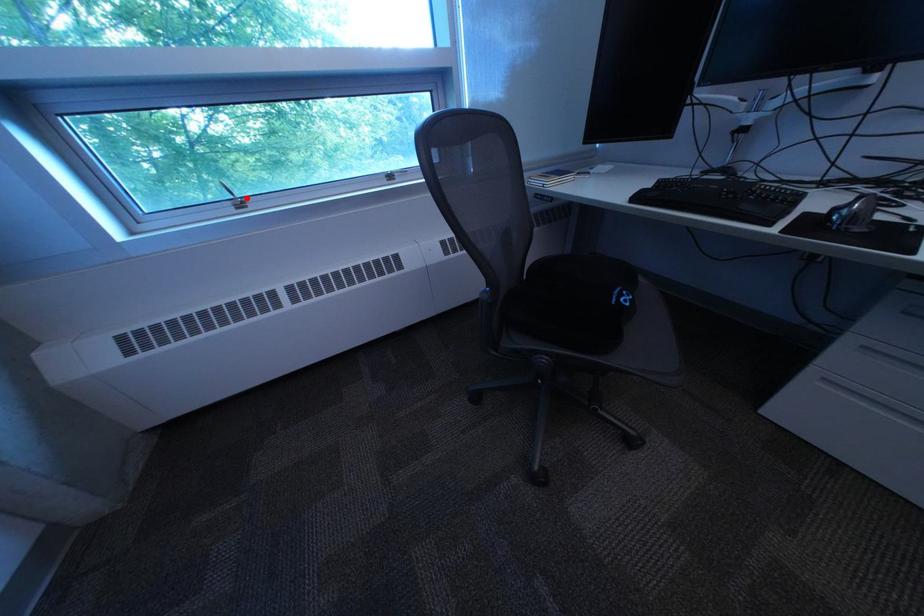
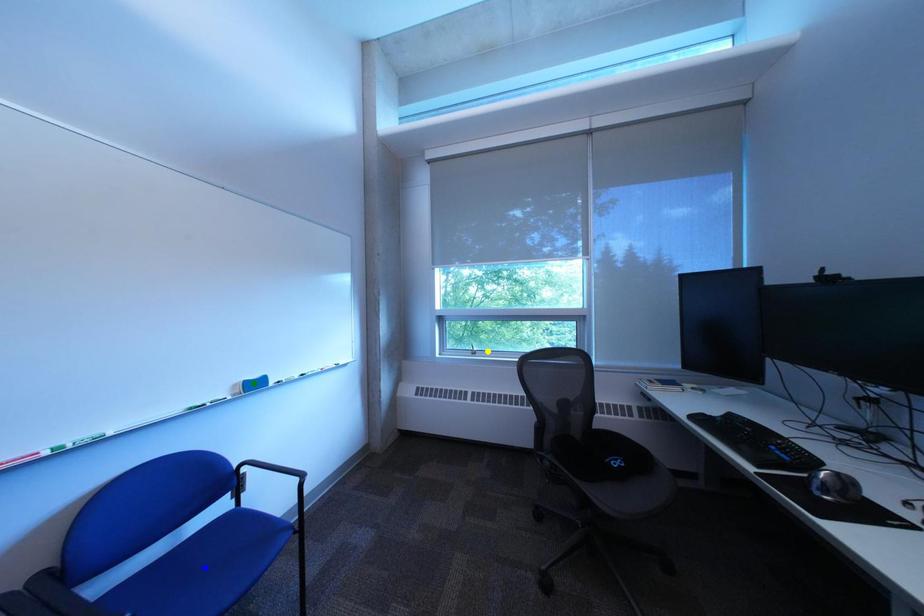
Question: I am providing you with two images of the same scene from different viewpoints. A red point is marked on the first image. You are given multiple points on the second image. Which mark in image 2 goes with the point in image 1?

Choices:
 (A) green point
 (B) blue point
 (C) yellow point

Answer: (C)